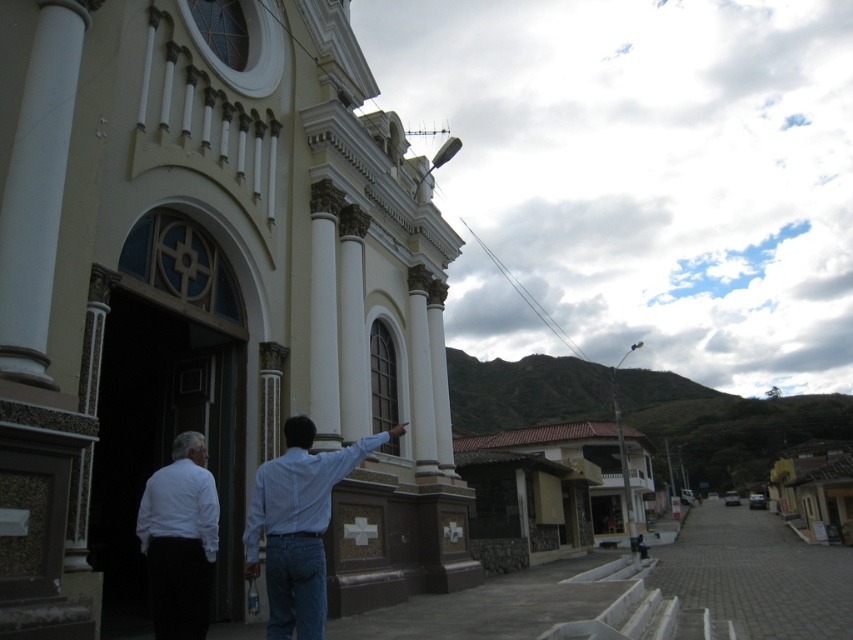
Who is more forward, [241,464] or [158,582]?

Point [158,582] is in front.

Looking at this image, is beige stone church at center taller than white matte shirt at lower left?

Yes.

Locate an element on the screen. This screenshot has height=640, width=853. beige stone church at center is located at coordinates (209, 294).

Can you confirm if beige stone church at center is bigger than light blue shirt at center?

Correct, beige stone church at center is larger in size than light blue shirt at center.

Find the location of a particular element. Image resolution: width=853 pixels, height=640 pixels. beige stone church at center is located at coordinates (209, 294).

This screenshot has width=853, height=640. Find the location of `beige stone church at center`. beige stone church at center is located at coordinates point(209,294).

Is point (283, 536) less distant than point (167, 512)?

Yes, it is in front of point (167, 512).

Between point (306, 636) and point (154, 589), which one is positioned behind?

The point (154, 589) is more distant.

Image resolution: width=853 pixels, height=640 pixels. Find the location of `light blue shirt at center`. light blue shirt at center is located at coordinates (299, 525).